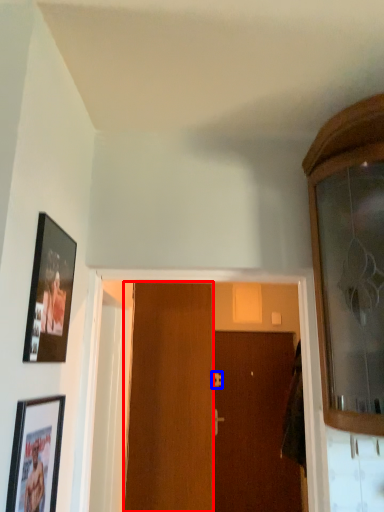
Question: Which object appears farthest to the camera in this image, door (highlighted by a red box) or door handle (highlighted by a blue box)?

Choices:
 (A) door
 (B) door handle

Answer: (B)